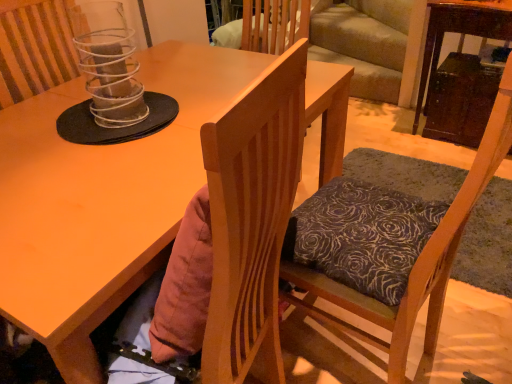
Question: Is clear plastic spiral at upper center smaller than wooden chair with patterned cushion at center?

Choices:
 (A) no
 (B) yes

Answer: (B)

Question: From a real-world perspective, is clear plastic spiral at upper center beneath wooden chair with patterned cushion at center?

Choices:
 (A) yes
 (B) no

Answer: (B)

Question: Considering the relative sizes of clear plastic spiral at upper center and wooden chair with patterned cushion at center in the image provided, is clear plastic spiral at upper center shorter than wooden chair with patterned cushion at center?

Choices:
 (A) no
 (B) yes

Answer: (B)

Question: From the image's perspective, is clear plastic spiral at upper center above wooden chair with patterned cushion at center?

Choices:
 (A) yes
 (B) no

Answer: (A)

Question: Is the position of clear plastic spiral at upper center less distant than that of wooden chair with patterned cushion at center?

Choices:
 (A) yes
 (B) no

Answer: (B)

Question: Is clear plastic spiral at upper center not inside wooden chair with patterned cushion at center?

Choices:
 (A) no
 (B) yes

Answer: (B)

Question: Would you consider matte wood desk at center to be distant from clear plastic spiral at upper center?

Choices:
 (A) yes
 (B) no

Answer: (B)

Question: From the image's perspective, is matte wood desk at center on top of clear plastic spiral at upper center?

Choices:
 (A) yes
 (B) no

Answer: (B)

Question: Can you confirm if matte wood desk at center is positioned to the left of clear plastic spiral at upper center?

Choices:
 (A) no
 (B) yes

Answer: (A)

Question: Is matte wood desk at center oriented towards clear plastic spiral at upper center?

Choices:
 (A) yes
 (B) no

Answer: (B)

Question: Is matte wood desk at center completely or partially outside of clear plastic spiral at upper center?

Choices:
 (A) yes
 (B) no

Answer: (A)

Question: Is the position of matte wood desk at center more distant than that of clear plastic spiral at upper center?

Choices:
 (A) no
 (B) yes

Answer: (A)

Question: Can you confirm if matte wood desk at center is wider than wooden chair with patterned cushion at center?

Choices:
 (A) yes
 (B) no

Answer: (A)